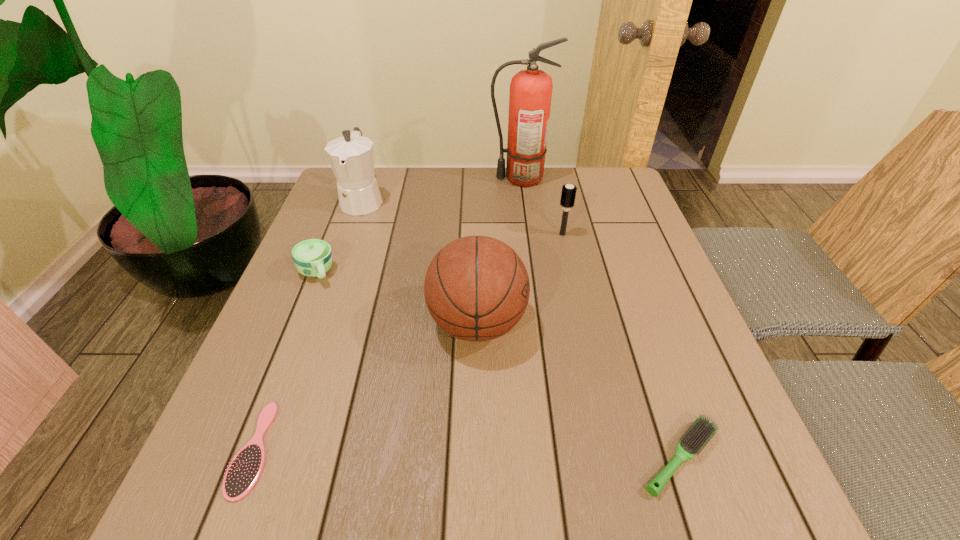
The image size is (960, 540). I want to click on vacant space that satisfies the following two spatial constraints: 1. at the spout of the coffeepot; 2. on the right side of the fifth nearest object, so click(350, 234).

Where is `free space that satisfies the following two spatial constraints: 1. on the nozzle of the second shortest object; 2. on the right side of the fire extinguisher`? This screenshot has height=540, width=960. free space that satisfies the following two spatial constraints: 1. on the nozzle of the second shortest object; 2. on the right side of the fire extinguisher is located at coordinates (556, 458).

Locate an element on the screen. free space in the image that satisfies the following two spatial constraints: 1. on the side with brand label of the basketball; 2. on the right side of the rightmost hairbrush is located at coordinates (476, 458).